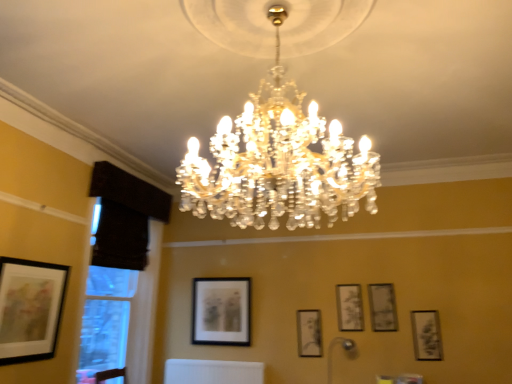
Question: Is metallic silver lamp at lower center, the second lamp positioned from the top, taller or shorter than matte black picture frame at center, the 3th picture frame viewed from the left?

Choices:
 (A) tall
 (B) short

Answer: (A)

Question: Choose the correct answer: Is metallic silver lamp at lower center, the 2th lamp from the left, inside matte black picture frame at center, the 3th picture frame viewed from the left, or outside it?

Choices:
 (A) outside
 (B) inside

Answer: (A)

Question: Estimate the real-world distances between objects in this image. Which object is closer to the matte black picture frame at center, the fifth picture frame in the right-to-left sequence?

Choices:
 (A) matte black picture frame at upper right, the fourth picture frame when ordered from back to front
 (B) black fabric window at left
 (C) matte black picture frame at center, which appears as the 2th picture frame when viewed from the back
 (D) matte black picture frame at upper right, which appears as the fifth picture frame when viewed from the back
 (E) black paper at center, the 3th picture frame viewed from the back

Answer: (C)

Question: Estimate the real-world distances between objects in this image. Which object is closer to the matte black picture frame at upper right, arranged as the 5th picture frame when viewed from the left?

Choices:
 (A) black paper at center, positioned as the 4th picture frame in front-to-back order
 (B) matte black picture frame at upper right, which is counted as the 1th picture frame, starting from the right
 (C) metallic silver lamp at lower center, acting as the 1th lamp starting from the right
 (D) matte black picture frame at center, the 3th picture frame viewed from the left
 (E) matte black picture frame at center, the fifth picture frame in the right-to-left sequence

Answer: (A)